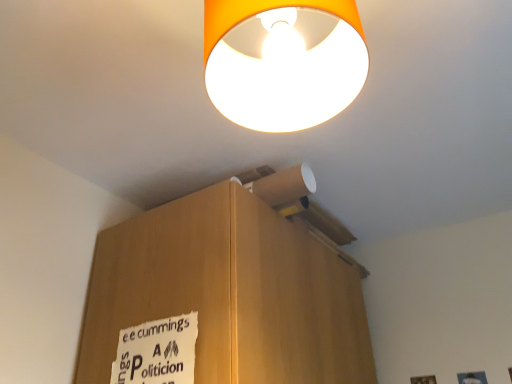
The width and height of the screenshot is (512, 384). I want to click on white paper sign at lower left, so click(x=157, y=352).

What do you see at coordinates (157, 352) in the screenshot?
I see `white paper sign at lower left` at bounding box center [157, 352].

Locate an element on the screen. orange matte lampshade at upper center is located at coordinates (283, 61).

What do you see at coordinates (283, 61) in the screenshot? I see `orange matte lampshade at upper center` at bounding box center [283, 61].

Measure the distance between point (294,117) and camera.

Point (294,117) is 29.84 inches from camera.

Where is `white paper sign at lower left`? The height and width of the screenshot is (384, 512). white paper sign at lower left is located at coordinates (157, 352).

Is orange matte lampshade at upper center to the left of white paper sign at lower left from the viewer's perspective?

In fact, orange matte lampshade at upper center is to the right of white paper sign at lower left.

Is the position of orange matte lampshade at upper center more distant than that of white paper sign at lower left?

No, orange matte lampshade at upper center is closer to the viewer.

Does point (243, 126) lie in front of point (177, 344)?

Yes.

From the image's perspective, who appears lower, orange matte lampshade at upper center or white paper sign at lower left?

white paper sign at lower left appears lower in the image.

From a real-world perspective, is orange matte lampshade at upper center located beneath white paper sign at lower left?

No, from a real-world perspective, orange matte lampshade at upper center is not beneath white paper sign at lower left.

Considering the relative sizes of orange matte lampshade at upper center and white paper sign at lower left in the image provided, is orange matte lampshade at upper center thinner than white paper sign at lower left?

Incorrect, the width of orange matte lampshade at upper center is not less than that of white paper sign at lower left.

Looking at this image, considering the sizes of objects orange matte lampshade at upper center and white paper sign at lower left in the image provided, who is shorter, orange matte lampshade at upper center or white paper sign at lower left?

orange matte lampshade at upper center is shorter.

Between orange matte lampshade at upper center and white paper sign at lower left, which one has larger size?

orange matte lampshade at upper center.

Which is correct: orange matte lampshade at upper center is inside white paper sign at lower left, or outside of it?

orange matte lampshade at upper center is not inside white paper sign at lower left, it's outside.

Is orange matte lampshade at upper center next to white paper sign at lower left?

orange matte lampshade at upper center and white paper sign at lower left are not in contact.

Is orange matte lampshade at upper center positioned with its back to white paper sign at lower left?

No, orange matte lampshade at upper center is not facing the opposite direction of white paper sign at lower left.

How distant is orange matte lampshade at upper center from white paper sign at lower left?

orange matte lampshade at upper center and white paper sign at lower left are 27.93 inches apart from each other.

The width and height of the screenshot is (512, 384). In the image, there is a orange matte lampshade at upper center. Identify the location of warning sign below it (from the image's perspective). (157, 352).

Visually, is white paper sign at lower left positioned to the left or to the right of orange matte lampshade at upper center?

white paper sign at lower left is to the left of orange matte lampshade at upper center.

Considering their positions, is white paper sign at lower left located in front of or behind orange matte lampshade at upper center?

Visually, white paper sign at lower left is located behind orange matte lampshade at upper center.

Does point (163, 381) lie behind point (305, 21)?

Yes, it is.

From the image's perspective, is white paper sign at lower left located above orange matte lampshade at upper center?

No, from the image's perspective, white paper sign at lower left is not above orange matte lampshade at upper center.

From a real-world perspective, is white paper sign at lower left below orange matte lampshade at upper center?

Yes, from a real-world perspective, white paper sign at lower left is under orange matte lampshade at upper center.

Is white paper sign at lower left wider than orange matte lampshade at upper center?

No, white paper sign at lower left is not wider than orange matte lampshade at upper center.

Which of these two, white paper sign at lower left or orange matte lampshade at upper center, stands shorter?

orange matte lampshade at upper center.

Can you confirm if white paper sign at lower left is smaller than orange matte lampshade at upper center?

Yes.

Consider the image. Is white paper sign at lower left completely or partially outside of orange matte lampshade at upper center?

white paper sign at lower left is positioned outside orange matte lampshade at upper center.

Is white paper sign at lower left not close to orange matte lampshade at upper center?

No, white paper sign at lower left is not far away from orange matte lampshade at upper center.

Is white paper sign at lower left oriented towards orange matte lampshade at upper center?

No, white paper sign at lower left does not turn towards orange matte lampshade at upper center.

Where is `lamp that appears above the white paper sign at lower left (from the image's perspective)`? This screenshot has width=512, height=384. lamp that appears above the white paper sign at lower left (from the image's perspective) is located at coordinates (283, 61).

Where is `warning sign located underneath the orange matte lampshade at upper center (from a real-world perspective)`? The height and width of the screenshot is (384, 512). warning sign located underneath the orange matte lampshade at upper center (from a real-world perspective) is located at coordinates (157, 352).

Where is `lamp located above the white paper sign at lower left (from a real-world perspective)`? lamp located above the white paper sign at lower left (from a real-world perspective) is located at coordinates (283, 61).